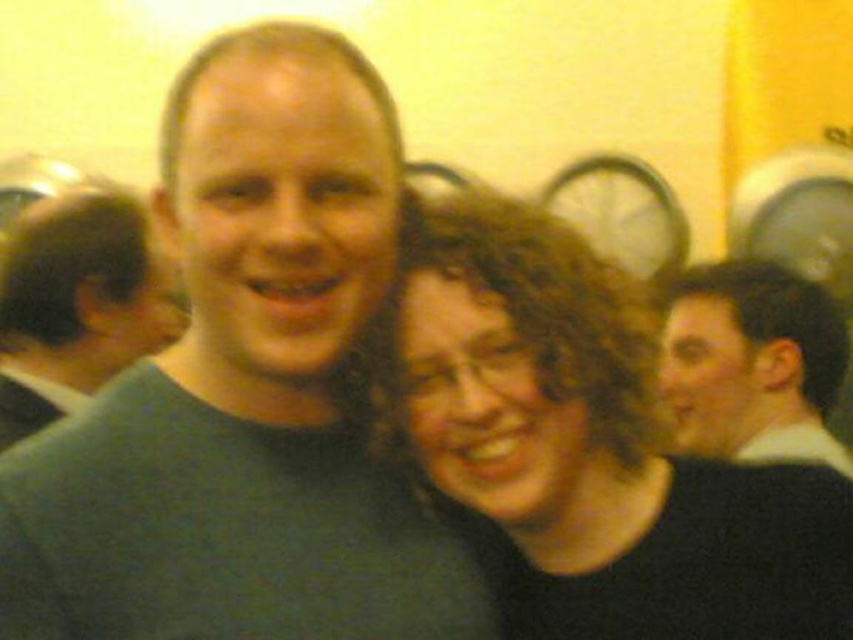
Question: Which object is the closest to the dark green sweater at left?

Choices:
 (A) light brown hair at right
 (B) black matte hair at center

Answer: (B)

Question: From the image, what is the correct spatial relationship of black matte hair at center in relation to light brown hair at right?

Choices:
 (A) below
 (B) above

Answer: (A)

Question: Does black matte hair at center have a greater width compared to dark green sweater at left?

Choices:
 (A) yes
 (B) no

Answer: (A)

Question: Where is dark green sweater at left located in relation to light brown hair at right in the image?

Choices:
 (A) left
 (B) right

Answer: (A)

Question: Which of the following is the closest to the observer?

Choices:
 (A) (10, 358)
 (B) (804, 352)

Answer: (B)

Question: Which object is the closest to the dark green sweater at left?

Choices:
 (A) light brown hair at right
 (B) black matte hair at center

Answer: (B)